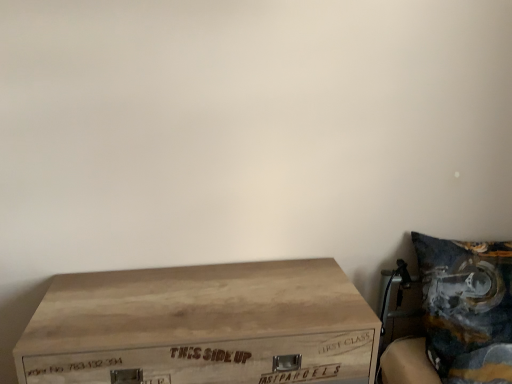
You are a GUI agent. You are given a task and a screenshot of the screen. Output one action in this format:
    pyautogui.click(x=<x>, y=<y>)
    Task: Click on the free space above natural wood box at lower left (from a real-world perspective)
    The width and height of the screenshot is (512, 384).
    Given the screenshot: What is the action you would take?
    pyautogui.click(x=201, y=292)